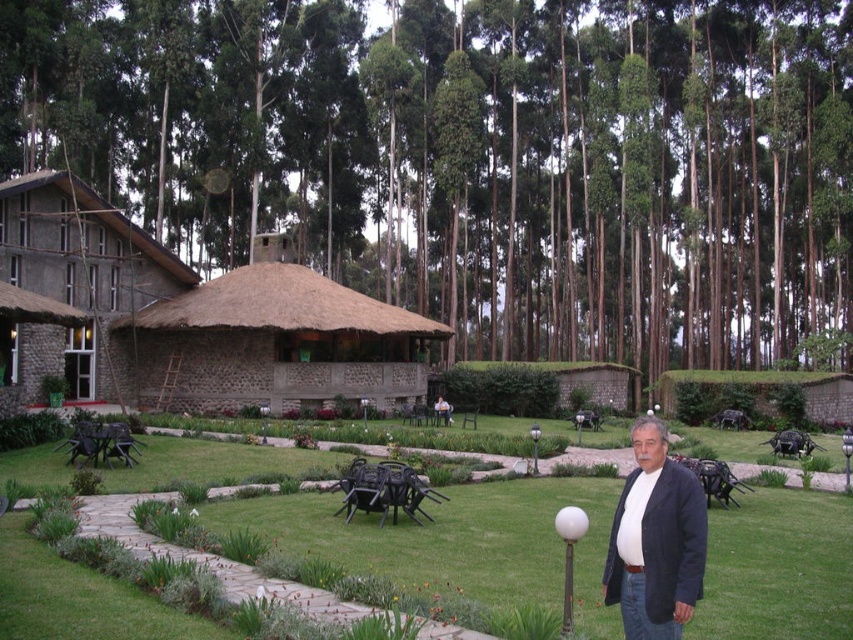
Does green grass at center have a lesser width compared to stucco thatched hut at upper left?

In fact, green grass at center might be wider than stucco thatched hut at upper left.

Is green grass at center bigger than stucco thatched hut at upper left?

Actually, green grass at center might be smaller than stucco thatched hut at upper left.

Between point (264, 518) and point (135, 269), which one is positioned in front?

Point (264, 518) is more forward.

Where is `green grass at center`? green grass at center is located at coordinates (453, 540).

Which of these two, brown thatch roof at upper center or stucco thatched hut at upper left, stands shorter?

stucco thatched hut at upper left is shorter.

Based on the photo, which is below, brown thatch roof at upper center or stucco thatched hut at upper left?

stucco thatched hut at upper left

Is point (416, 284) closer to camera compared to point (154, 240)?

No.

Where is `brown thatch roof at upper center`? This screenshot has height=640, width=853. brown thatch roof at upper center is located at coordinates (477, 156).

Between brown thatch roof at upper center and green grass at center, which one is positioned higher?

Positioned higher is brown thatch roof at upper center.

Can you confirm if brown thatch roof at upper center is positioned to the left of green grass at center?

Incorrect, brown thatch roof at upper center is not on the left side of green grass at center.

Where is `brown thatch roof at upper center`? The height and width of the screenshot is (640, 853). brown thatch roof at upper center is located at coordinates (477, 156).

At what (x,y) coordinates should I click in order to perform the action: click on brown thatch roof at upper center. Please return your answer as a coordinate pair (x, y). Looking at the image, I should click on (477, 156).